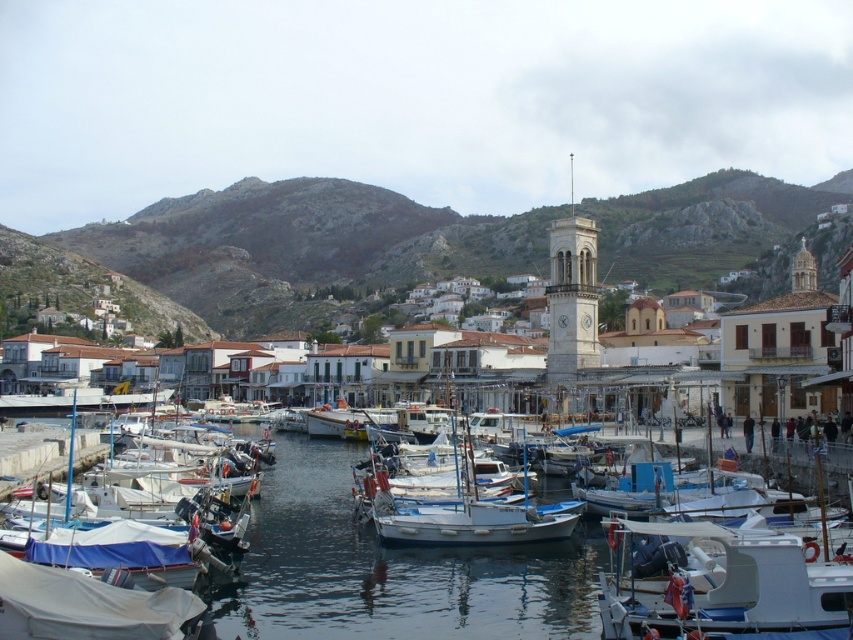
Question: Does white tarpaulin boat at lower left appear on the right side of white matte boat at center?

Choices:
 (A) no
 (B) yes

Answer: (A)

Question: Which of the following is the closest to the observer?

Choices:
 (A) (132, 264)
 (B) (421, 586)
 (C) (363, 483)

Answer: (B)

Question: Is white matte boat at lower right above white tarpaulin boat at lower left?

Choices:
 (A) yes
 (B) no

Answer: (A)

Question: Does white matte buildings at center have a larger size compared to white matte boat at lower right?

Choices:
 (A) no
 (B) yes

Answer: (B)

Question: Which of the following is the farthest from the observer?

Choices:
 (A) smooth blue water at center
 (B) white matte buildings at center
 (C) white matte boat at center
 (D) white matte boat at lower right

Answer: (B)

Question: Among these points, which one is farthest from the camera?

Choices:
 (A) (305, 248)
 (B) (227, 588)
 (C) (373, 493)
 (D) (611, 582)

Answer: (A)